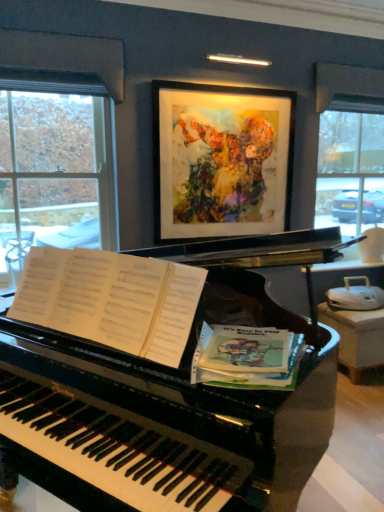
Question: Is green paper at piano right positioned in front of clear glass window at left?

Choices:
 (A) no
 (B) yes

Answer: (B)

Question: Are green paper at piano right and clear glass window at left located far from each other?

Choices:
 (A) no
 (B) yes

Answer: (B)

Question: Does green paper at piano right turn towards clear glass window at left?

Choices:
 (A) yes
 (B) no

Answer: (B)

Question: Is green paper at piano right taller than clear glass window at left?

Choices:
 (A) no
 (B) yes

Answer: (A)

Question: From a real-world perspective, is green paper at piano right over clear glass window at left?

Choices:
 (A) yes
 (B) no

Answer: (B)

Question: Is green paper at piano right bigger or smaller than clear glass window at left?

Choices:
 (A) small
 (B) big

Answer: (A)

Question: In terms of width, does green paper at piano right look wider or thinner when compared to clear glass window at left?

Choices:
 (A) wide
 (B) thin

Answer: (A)

Question: Would you say green paper at piano right is to the left or to the right of clear glass window at left in the picture?

Choices:
 (A) left
 (B) right

Answer: (B)

Question: Is green paper at piano right taller or shorter than clear glass window at left?

Choices:
 (A) short
 (B) tall

Answer: (A)

Question: From a real-world perspective, relative to glossy black piano at center, is clear glass window at left vertically above or below?

Choices:
 (A) above
 (B) below

Answer: (A)

Question: Considering the positions of clear glass window at left and glossy black piano at center in the image, is clear glass window at left wider or thinner than glossy black piano at center?

Choices:
 (A) thin
 (B) wide

Answer: (A)

Question: From the image's perspective, relative to glossy black piano at center, is clear glass window at left above or below?

Choices:
 (A) below
 (B) above

Answer: (B)

Question: From their relative heights in the image, would you say clear glass window at left is taller or shorter than glossy black piano at center?

Choices:
 (A) short
 (B) tall

Answer: (A)

Question: From the image's perspective, is glossy black piano at center above or below clear glass window at left?

Choices:
 (A) above
 (B) below

Answer: (B)

Question: Looking at the image, does glossy black piano at center seem bigger or smaller compared to clear glass window at left?

Choices:
 (A) big
 (B) small

Answer: (A)